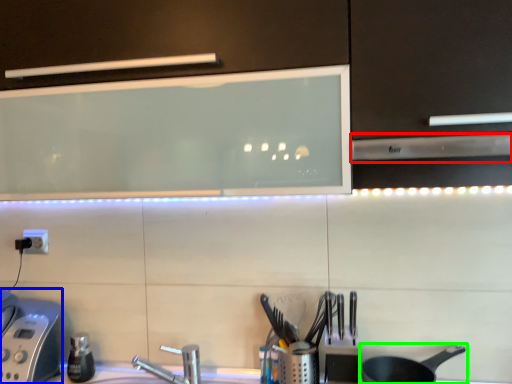
Question: Considering the real-world distances, which object is closest to exhaust hood (highlighted by a red box)? appliance (highlighted by a blue box) or frying pan (highlighted by a green box).

Choices:
 (A) appliance
 (B) frying pan

Answer: (B)